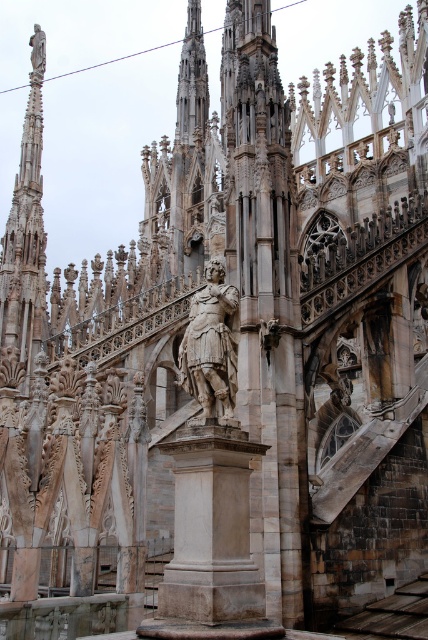
Question: Does polished stone spire at upper left have a smaller size compared to polished bronze statue at center?

Choices:
 (A) yes
 (B) no

Answer: (B)

Question: Which of the following is the closest to the observer?

Choices:
 (A) (32, 81)
 (B) (214, 390)

Answer: (B)

Question: Which point is closer to the camera?

Choices:
 (A) polished stone spire at upper left
 (B) polished bronze statue at center

Answer: (B)

Question: Is polished stone spire at upper left wider than polished bronze statue at center?

Choices:
 (A) yes
 (B) no

Answer: (A)

Question: Does polished stone spire at upper left have a smaller size compared to polished bronze statue at center?

Choices:
 (A) yes
 (B) no

Answer: (B)